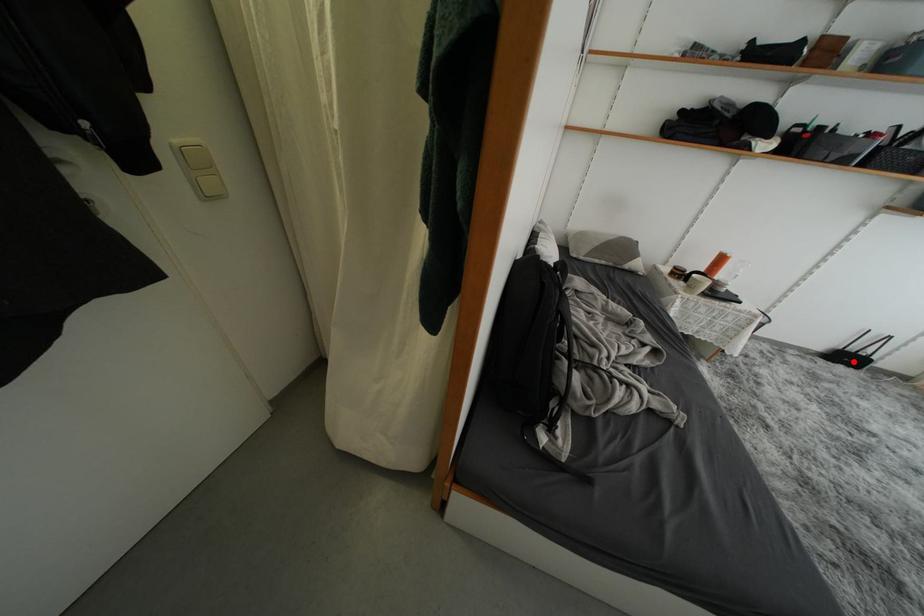
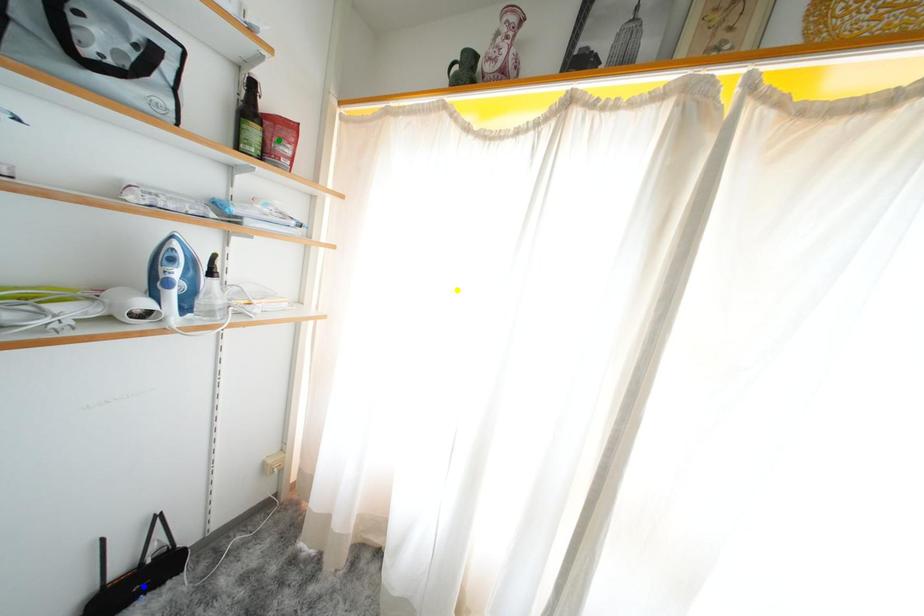
Question: I am providing you with two images of the same scene from different viewpoints. A red point is marked on the first image. You are given multiple points on the second image. In image 2, which mark is for the same physical point as the one in image 1?

Choices:
 (A) yellow point
 (B) blue point
 (C) green point

Answer: (B)